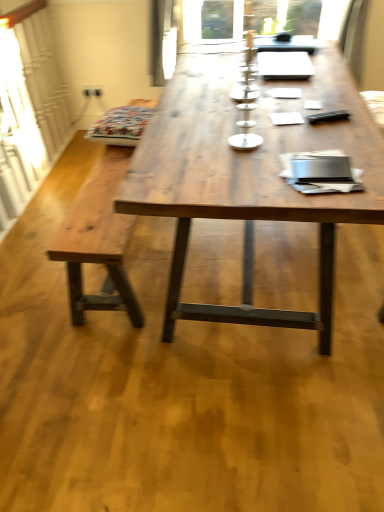
This screenshot has height=512, width=384. What are the coordinates of `vacant area on top of wooden bench at left (from a real-world perspective)` in the screenshot? It's located at 102,186.